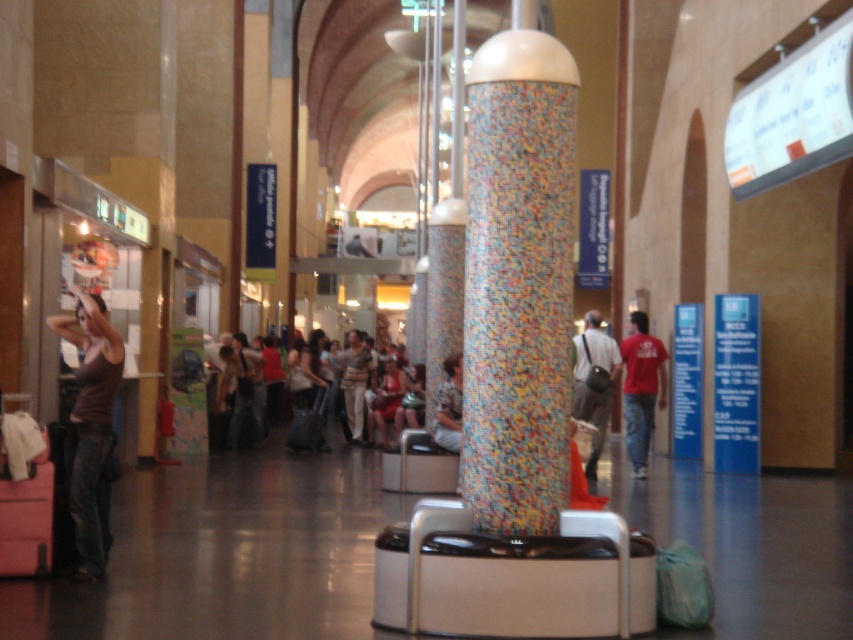
Question: Does matte white shirt at center have a smaller size compared to red cotton t-shirt at center?

Choices:
 (A) no
 (B) yes

Answer: (B)

Question: Which point is closer to the camera?

Choices:
 (A) red cotton t-shirt at center
 (B) matte brown tank top at left
 (C) mosaic tile column at center

Answer: (C)

Question: Which of the following is the closest to the observer?

Choices:
 (A) (262, 381)
 (B) (456, 385)
 (C) (596, 451)

Answer: (B)

Question: Based on their relative distances, which object is farther from the red cotton t-shirt at center?

Choices:
 (A) matte white shirt at center
 (B) mosaic tile column at center

Answer: (B)

Question: Where is matte brown tank top at left located in relation to matte white shirt at center in the image?

Choices:
 (A) left
 (B) right

Answer: (B)

Question: Is matte white shirt at center closer to the viewer compared to red cotton t-shirt at center?

Choices:
 (A) yes
 (B) no

Answer: (B)